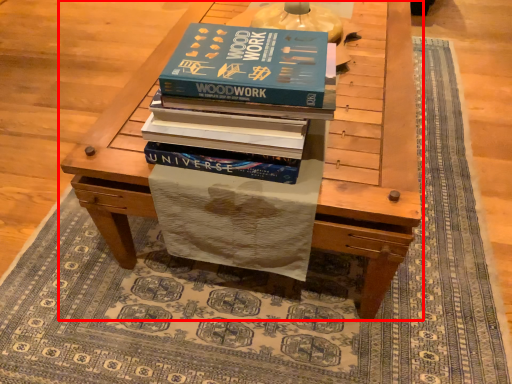
Question: Observing the image, what is the correct spatial positioning of table (annotated by the red box) in reference to book?

Choices:
 (A) left
 (B) right

Answer: (B)